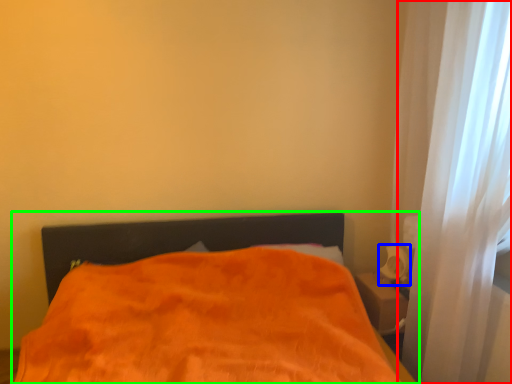
Question: Which object is positioned farthest from curtain (highlighted by a red box)? Select from table lamp (highlighted by a blue box) and bed (highlighted by a green box).

Choices:
 (A) table lamp
 (B) bed

Answer: (B)